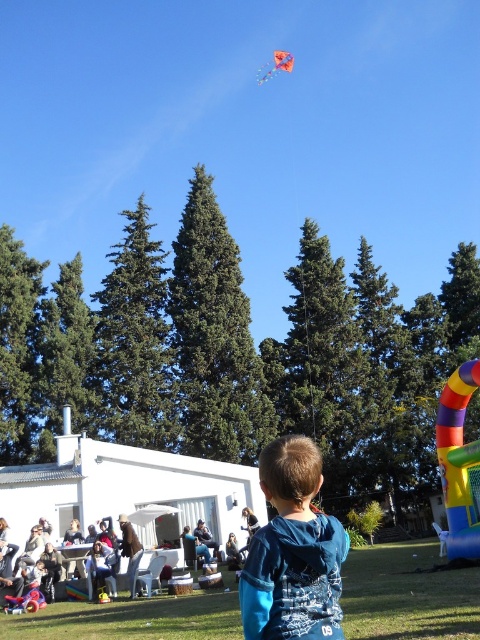
Does green textured pine at center appear under multicolored fabric kite at upper center?

Yes.

Looking at this image, can you confirm if green textured pine at center is bigger than multicolored fabric kite at upper center?

Indeed, green textured pine at center has a larger size compared to multicolored fabric kite at upper center.

Is point (256, 376) closer to viewer compared to point (259, 74)?

Yes.

Locate an element on the screen. The height and width of the screenshot is (640, 480). green textured pine at center is located at coordinates (214, 337).

Which is behind, point (271, 529) or point (216, 548)?

The point (216, 548) is behind.

Is point (291, 509) positioned in front of point (199, 525)?

Yes, point (291, 509) is closer to viewer.

Which is in front, point (284, 540) or point (196, 522)?

Point (284, 540)

Find the location of `blue cotton shirt at lower center`. blue cotton shirt at lower center is located at coordinates (292, 552).

Who is higher up, green textured pine at center or dark blue shirt at lower center?

green textured pine at center is higher up.

From the picture: Is green textured pine at center taller than dark blue shirt at lower center?

Correct, green textured pine at center is much taller as dark blue shirt at lower center.

Describe the element at coordinates (214, 337) in the screenshot. I see `green textured pine at center` at that location.

The height and width of the screenshot is (640, 480). I want to click on green textured pine at center, so click(214, 337).